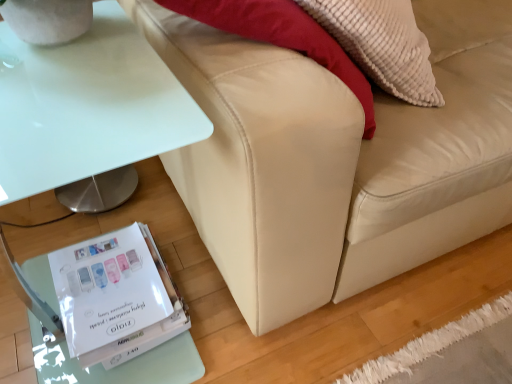
This screenshot has height=384, width=512. Find the location of `free space above white glossy paperback book at lower left (from a real-world perspective)`. free space above white glossy paperback book at lower left (from a real-world perspective) is located at coordinates (109, 279).